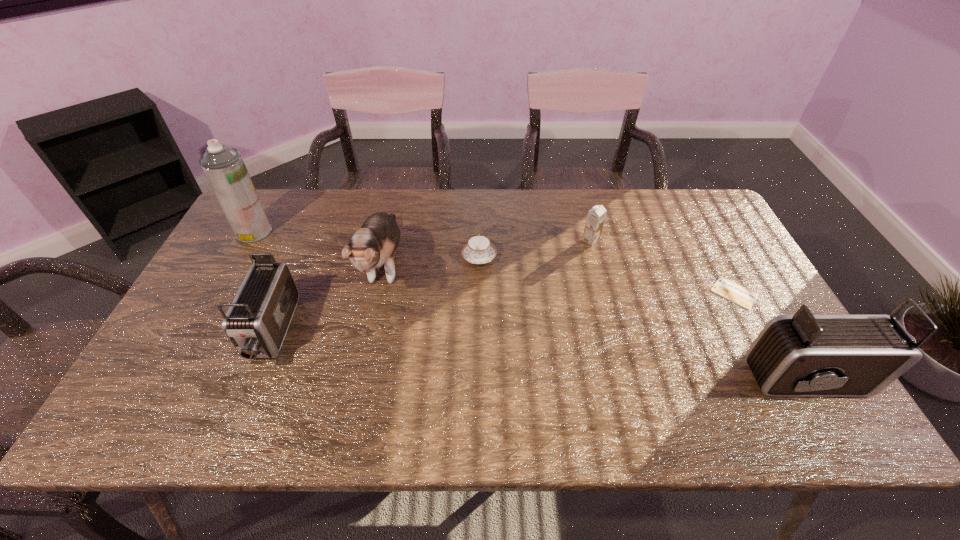
Where is `blank region between the left camcorder and the fifth object from left to right`? This screenshot has height=540, width=960. blank region between the left camcorder and the fifth object from left to right is located at coordinates (431, 286).

This screenshot has width=960, height=540. Identify the location of empty location between the leftmost object and the right camcorder. [x=535, y=305].

Locate an element on the screen. object that stands as the second closest to the left camcorder is located at coordinates (224, 168).

Locate an element on the screen. This screenshot has width=960, height=540. object that can be found as the second closest to the shortest object is located at coordinates (596, 216).

Find the location of `free location that satisfies the following two spatial constraints: 1. on the side with the handle of the second shortest object; 2. on the right side of the third object from right to left`. free location that satisfies the following two spatial constraints: 1. on the side with the handle of the second shortest object; 2. on the right side of the third object from right to left is located at coordinates (479, 240).

Find the location of a particular element. blank area in the image that satisfies the following two spatial constraints: 1. at the face of the shortest object; 2. on the right side of the fifth object from right to left is located at coordinates (378, 293).